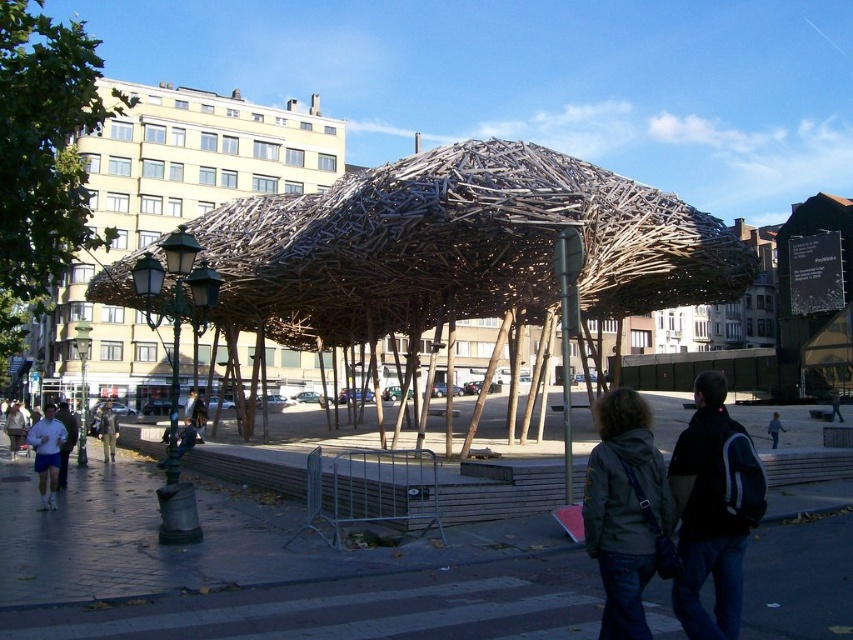
You are a photographer standing at the edge of the plaza. You want to capture a photo that includes both the khaki fabric jacket at lower left and the dark blue jeans at center. Based on their positions, which object should you focus on first to ensure both are in frame?

The khaki fabric jacket at lower left is located below dark blue jeans at center. To include both in the frame, focus on the khaki fabric jacket at lower left first as it is positioned lower, then adjust the camera angle to include the dark blue jeans at center above it.

You are standing at the center of the urban plaza and see the denim jacket at lower right. If you want to walk directly towards it, in which direction should you move relative to your current position?

To walk directly towards the denim jacket at lower right, you should move towards the lower right direction since its 2D coordinates are at point (624, 509), which is located in the lower right quadrant of the image.

You are standing at the edge of the plaza and see the denim jacket at lower right and the khaki fabric jacket at lower left. Which jacket is closer to you?

The denim jacket at lower right is closer to you because it is in front of the khaki fabric jacket at lower left.